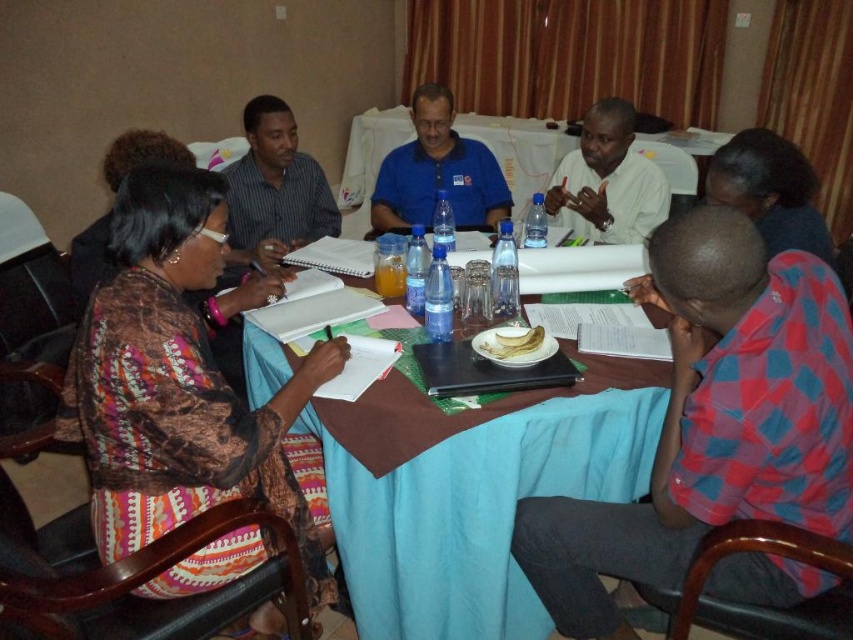
You are sitting at the rectangular table in the meeting room and need to reach both the point at coordinate point (795,401) and point at coordinate point (111,266). Which coordinate point is closer to you?

Point (795,401) is in front of point (111,266), so it is closer to you.

You are a photographer trying to capture a closeup of the dark brown hair at lower right and the patterned fabric dress at left. Since you want both subjects to be in focus, which object should you adjust the camera focus on first?

The dark brown hair at lower right has a smaller size compared to the patterned fabric dress at left. To ensure both are in focus, adjust the focus on the smaller dark brown hair at lower right first, as it requires a narrower depth of field.